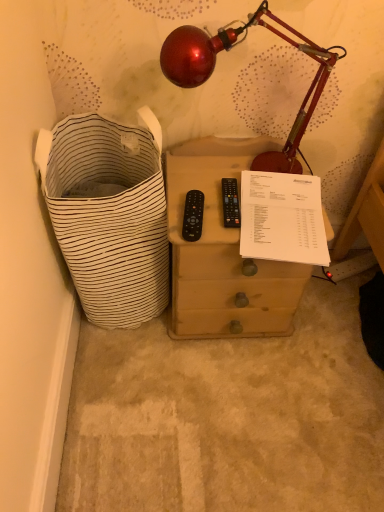
Question: Is white striped fabric laundry basket at left completely or partially outside of black plastic remote at center, the 1th control viewed from the left?

Choices:
 (A) yes
 (B) no

Answer: (A)

Question: From the image's perspective, does white striped fabric laundry basket at left appear lower than black plastic remote at center, the 2th control positioned from the right?

Choices:
 (A) yes
 (B) no

Answer: (A)

Question: Is the depth of white striped fabric laundry basket at left less than that of black plastic remote at center, the 2th control positioned from the right?

Choices:
 (A) yes
 (B) no

Answer: (A)

Question: From the image's perspective, is white striped fabric laundry basket at left on black plastic remote at center, the 2th control positioned from the right?

Choices:
 (A) no
 (B) yes

Answer: (A)

Question: Can you confirm if white striped fabric laundry basket at left is bigger than black plastic remote at center, the 1th control viewed from the left?

Choices:
 (A) yes
 (B) no

Answer: (A)

Question: Considering the positions of point (226, 189) and point (46, 193), is point (226, 189) closer or farther from the camera than point (46, 193)?

Choices:
 (A) closer
 (B) farther

Answer: (B)

Question: In terms of size, does black plastic remote at center, the second control when ordered from left to right, appear bigger or smaller than white striped fabric laundry basket at left?

Choices:
 (A) small
 (B) big

Answer: (A)

Question: Considering their positions, is black plastic remote at center, which ranks as the first control in right-to-left order, located in front of or behind white striped fabric laundry basket at left?

Choices:
 (A) behind
 (B) front

Answer: (A)

Question: Considering the positions of black plastic remote at center, which ranks as the first control in right-to-left order, and white striped fabric laundry basket at left in the image, is black plastic remote at center, which ranks as the first control in right-to-left order, taller or shorter than white striped fabric laundry basket at left?

Choices:
 (A) tall
 (B) short

Answer: (B)

Question: Considering the relative positions of white paper at upper right and metallic red lamp at upper center in the image provided, is white paper at upper right to the left or to the right of metallic red lamp at upper center?

Choices:
 (A) left
 (B) right

Answer: (B)

Question: Considering their positions, is white paper at upper right located in front of or behind metallic red lamp at upper center?

Choices:
 (A) front
 (B) behind

Answer: (B)

Question: Looking at the image, does white paper at upper right seem bigger or smaller compared to metallic red lamp at upper center?

Choices:
 (A) big
 (B) small

Answer: (B)

Question: From a real-world perspective, relative to metallic red lamp at upper center, is white paper at upper right vertically above or below?

Choices:
 (A) above
 (B) below

Answer: (B)

Question: From the image's perspective, is white paper at upper right above or below black plastic remote at center, the second control when ordered from left to right?

Choices:
 (A) above
 (B) below

Answer: (B)

Question: Considering the positions of white paper at upper right and black plastic remote at center, which ranks as the first control in right-to-left order, in the image, is white paper at upper right taller or shorter than black plastic remote at center, which ranks as the first control in right-to-left order,?

Choices:
 (A) short
 (B) tall

Answer: (B)